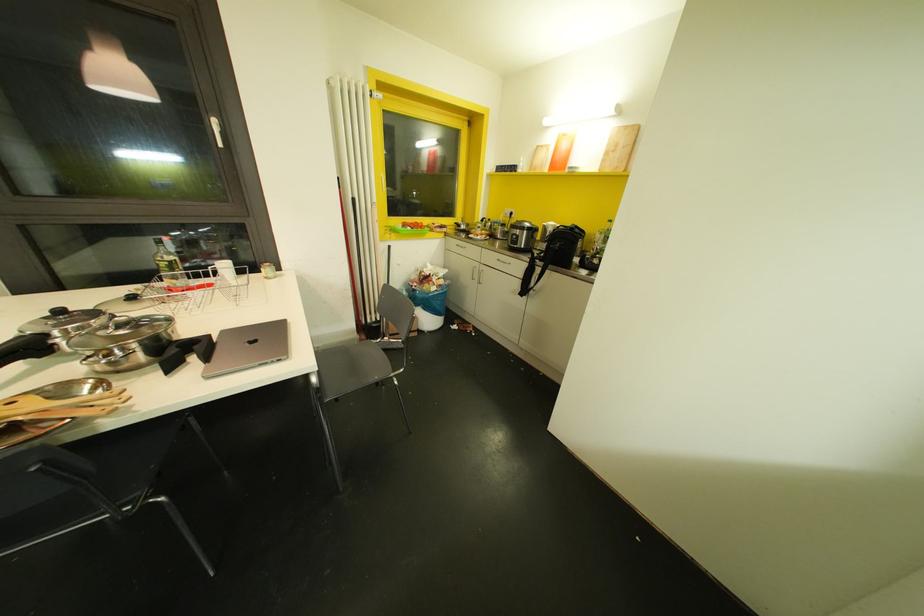
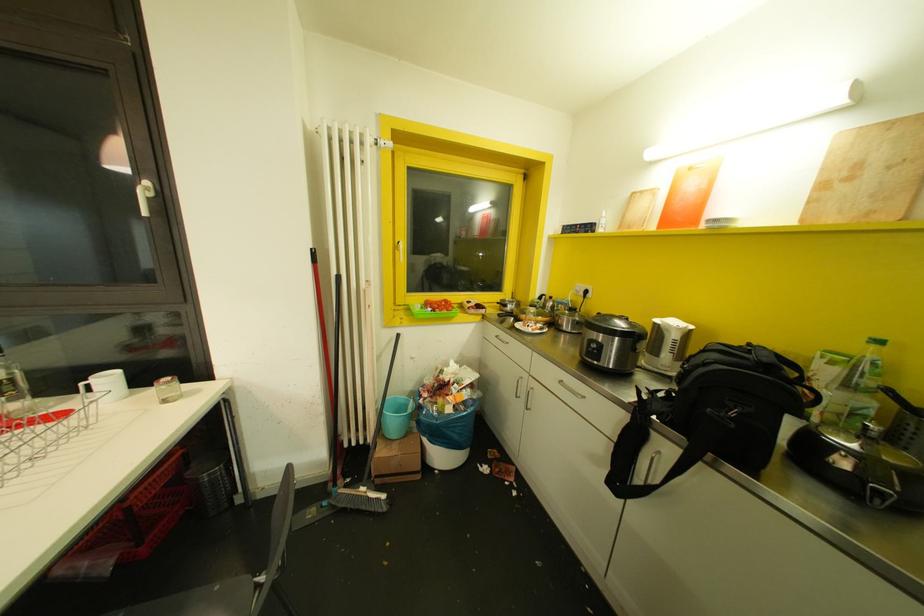
Question: In a continuous first-person perspective shot, in which direction is the camera moving?

Choices:
 (A) Left
 (B) Right
 (C) Forward
 (D) Backward

Answer: (C)